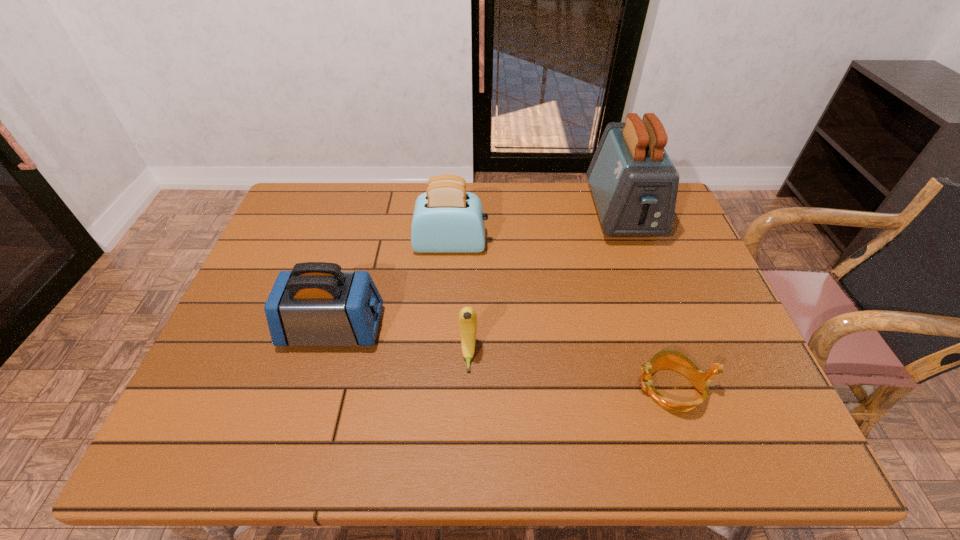
Where is `object that is at the near right corner`? The image size is (960, 540). object that is at the near right corner is located at coordinates (672, 359).

I want to click on blank space at the far edge of the desktop, so click(x=514, y=182).

At what (x,y) coordinates should I click in order to perform the action: click on blank area at the near edge. Please return your answer as a coordinate pair (x, y). The height and width of the screenshot is (540, 960). Looking at the image, I should click on (356, 437).

Image resolution: width=960 pixels, height=540 pixels. In the image, there is a desktop. Identify the location of vacant space at the left edge. (215, 400).

Where is `free space at the right edge`? free space at the right edge is located at coordinates (694, 278).

Locate an element on the screen. This screenshot has height=540, width=960. vacant space at the far left corner of the desktop is located at coordinates (324, 208).

Image resolution: width=960 pixels, height=540 pixels. Identify the location of vacant area at the near left corner. (210, 437).

This screenshot has height=540, width=960. What are the coordinates of `blank region between the tiara and the tallest object` in the screenshot? It's located at (646, 301).

Locate an element on the screen. The image size is (960, 540). unoccupied area between the leftmost toaster and the second toaster from left to right is located at coordinates (392, 287).

You are a GUI agent. You are given a task and a screenshot of the screen. Output one action in this format:
    pyautogui.click(x=<x>, y=<y>)
    Task: Click on the free area in between the tallest toaster and the leftmost toaster
    The height and width of the screenshot is (540, 960).
    Given the screenshot: What is the action you would take?
    pyautogui.click(x=478, y=271)